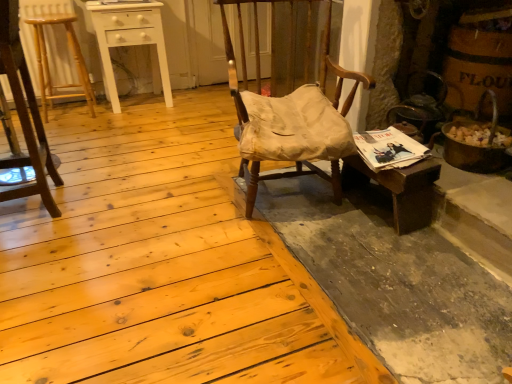
The width and height of the screenshot is (512, 384). What are the coordinates of `vacant point to the right of light brown wood bar stool at left` in the screenshot? It's located at (108, 119).